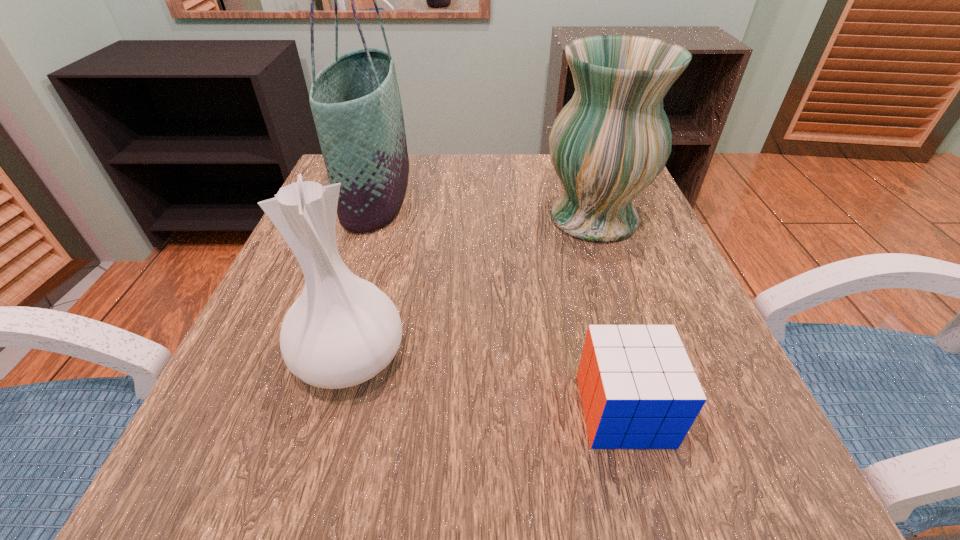
You are a GUI agent. You are given a task and a screenshot of the screen. Output one action in this format:
    pyautogui.click(x=<x>, y=<y>)
    Task: Click on the free area in between the third tallest object and the right vase
    The height and width of the screenshot is (540, 960).
    Given the screenshot: What is the action you would take?
    pyautogui.click(x=472, y=287)

Locate an element on the screen. The image size is (960, 540). vacant region between the farther vase and the shortest object is located at coordinates (609, 314).

You are a GUI agent. You are given a task and a screenshot of the screen. Output one action in this format:
    pyautogui.click(x=<x>, y=<y>)
    Task: Click on the free spot between the farther vase and the tallest object
    This screenshot has height=540, width=960.
    Given the screenshot: What is the action you would take?
    pyautogui.click(x=485, y=205)

The image size is (960, 540). I want to click on object that is the closest to the farther vase, so coord(638,389).

Locate an element on the screen. Image resolution: width=960 pixels, height=540 pixels. object that is the third nearest to the shortest object is located at coordinates (355, 101).

This screenshot has width=960, height=540. Identify the location of free location that satisfies the following two spatial constraints: 1. on the back side of the right vase; 2. on the right side of the shorter vase. (388, 218).